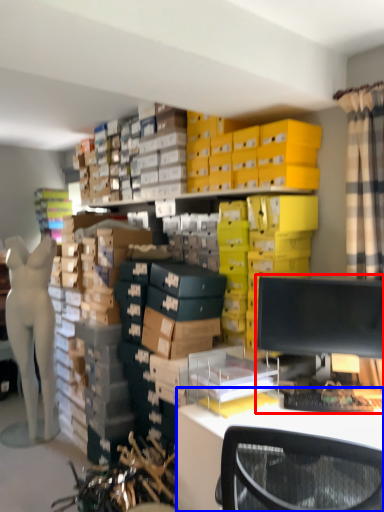
Question: Which object is closer to the camera taking this photo, desktop computer (highlighted by a red box) or desk (highlighted by a blue box)?

Choices:
 (A) desktop computer
 (B) desk

Answer: (B)